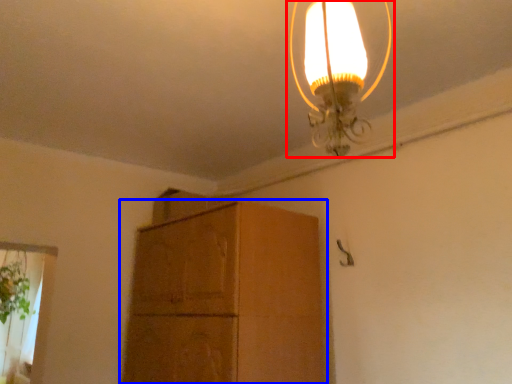
Question: Which point is closer to the camera, lamp (highlighted by a red box) or cabinetry (highlighted by a blue box)?

Choices:
 (A) lamp
 (B) cabinetry

Answer: (A)